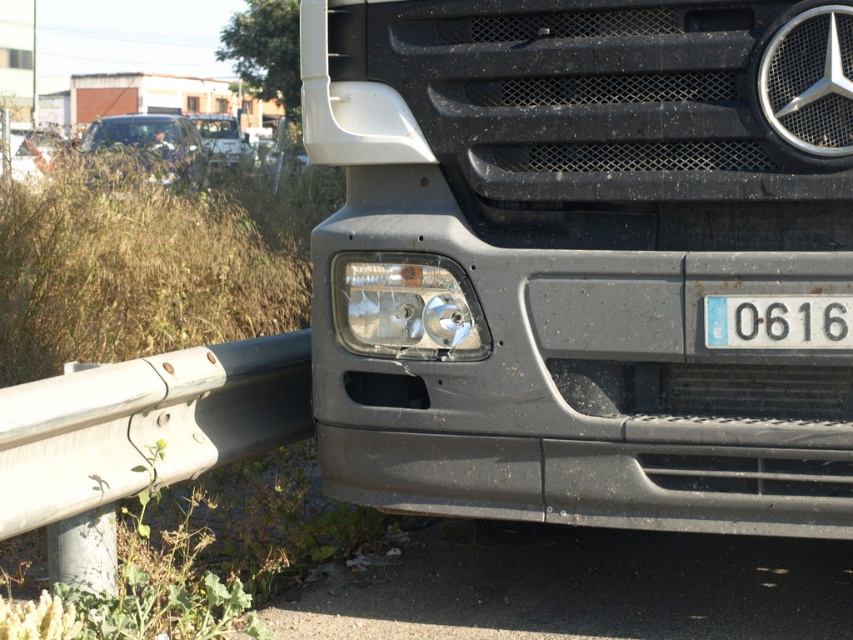
Is matte black truck at center closer to camera compared to green leafy weed at lower left?

No, matte black truck at center is further to the viewer.

Does matte black truck at center have a larger size compared to green leafy weed at lower left?

Yes.

Who is more forward, (544, 348) or (144, 540)?

Point (544, 348)

You are a GUI agent. You are given a task and a screenshot of the screen. Output one action in this format:
    pyautogui.click(x=<x>, y=<y>)
    Task: Click on the matte black truck at center
    
    Given the screenshot: What is the action you would take?
    pyautogui.click(x=579, y=257)

In order to click on matte black truck at center in this screenshot , I will do `click(579, 257)`.

Measure the distance from matte black truck at center to transparent plastic headlight at lower left.

matte black truck at center and transparent plastic headlight at lower left are 15.15 inches apart.

At what (x,y) coordinates should I click in order to perform the action: click on matte black truck at center. Please return your answer as a coordinate pair (x, y). This screenshot has width=853, height=640. Looking at the image, I should click on (579, 257).

Which is more to the left, green leafy weed at lower left or white plastic license plate at center?

green leafy weed at lower left

Which is in front, point (177, 580) or point (706, 305)?

Point (706, 305) is more forward.

Where is `green leafy weed at lower left`? This screenshot has height=640, width=853. green leafy weed at lower left is located at coordinates (136, 600).

You are a GUI agent. You are given a task and a screenshot of the screen. Output one action in this format:
    pyautogui.click(x=<x>, y=<y>)
    Task: Click on the green leafy weed at lower left
    
    Given the screenshot: What is the action you would take?
    pyautogui.click(x=136, y=600)